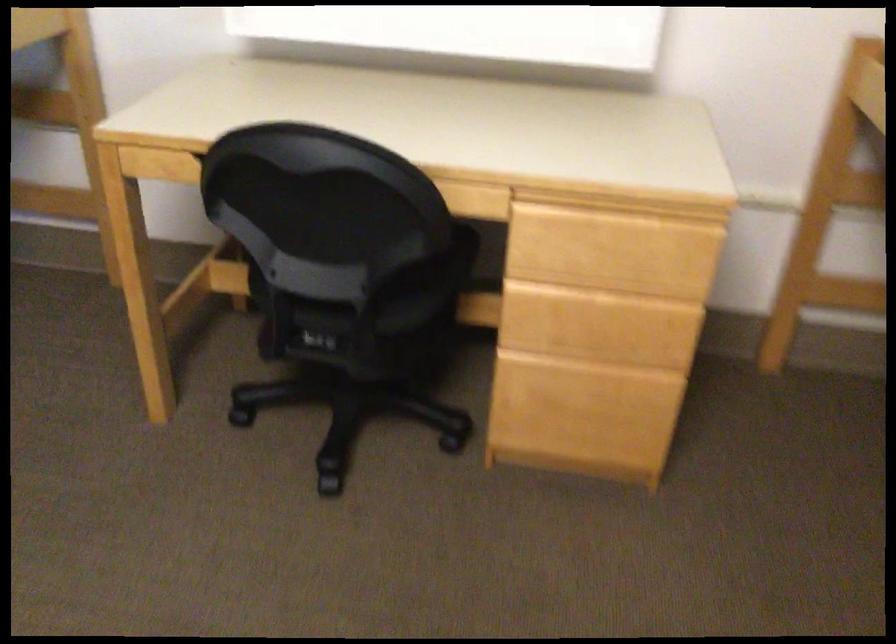
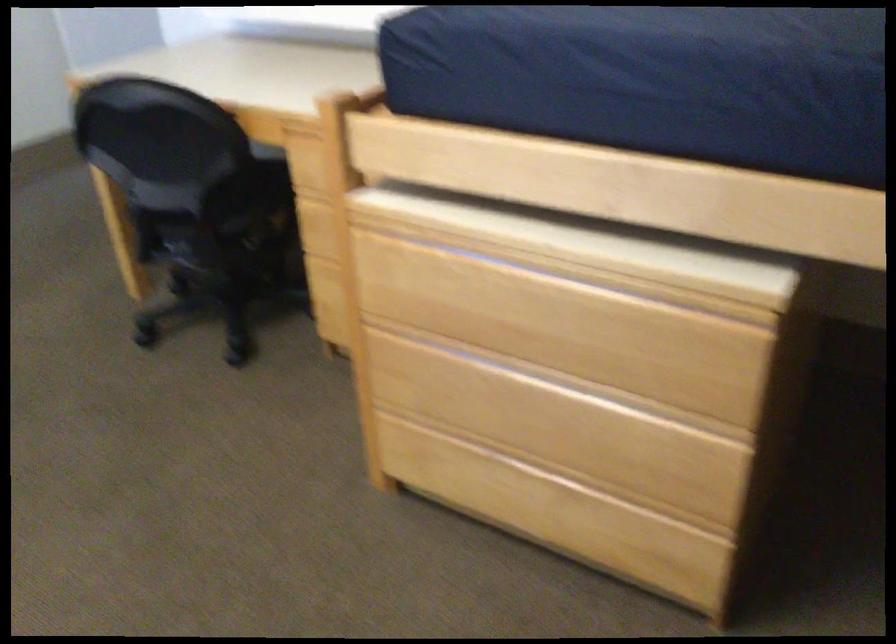
The images are taken continuously from a first-person perspective. In which direction is your viewpoint rotating?

The rotation direction of the camera is left-down.